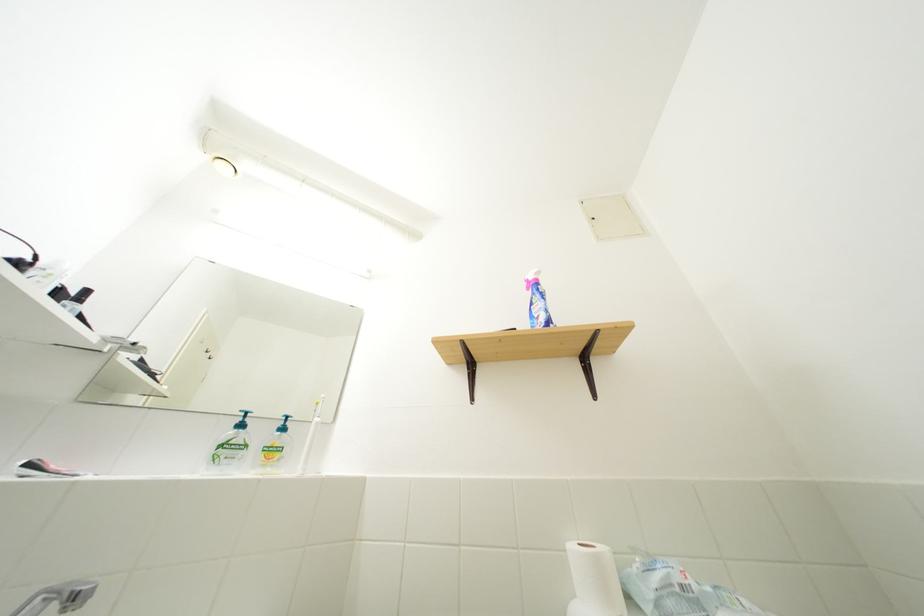
Find the location of a particular element. The image size is (924, 616). yellow soap pump is located at coordinates (284, 424).